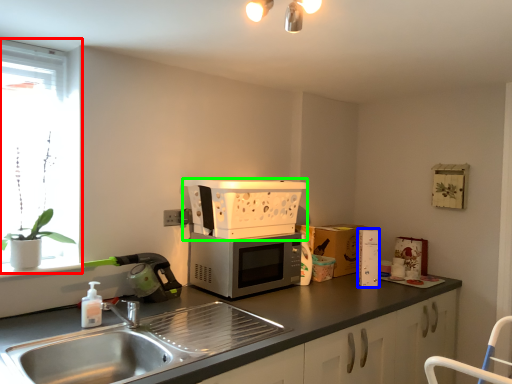
Question: Which object is the closest to the window (highlighted by a red box)? Choose among these: appliance (highlighted by a blue box) or appliance (highlighted by a green box).

Choices:
 (A) appliance
 (B) appliance

Answer: (B)